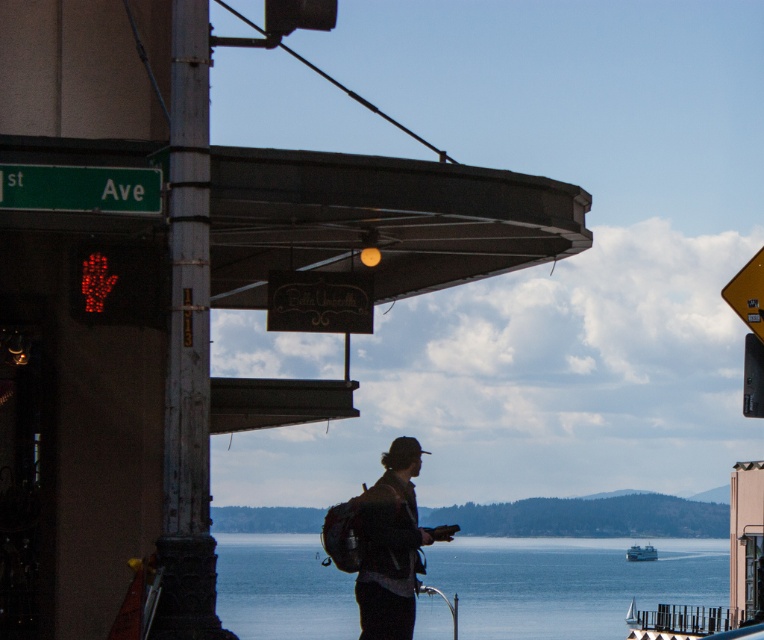
Between point (295, 262) and point (403, 593), which one is positioned behind?

The point (295, 262) is behind.

At what (x,y) coordinates should I click in order to perform the action: click on black matte awning at upper center. Please return your answer as a coordinate pair (x, y). This screenshot has width=764, height=640. Looking at the image, I should click on (379, 220).

Measure the distance between point (332, 570) and camera.

616.80 feet

Who is positioned more to the left, blue water at center or dark gray backpack at center?

From the viewer's perspective, blue water at center appears more on the left side.

Image resolution: width=764 pixels, height=640 pixels. Identify the location of blue water at center. (568, 582).

Which is in front, point (410, 522) or point (740, 280)?

Point (740, 280) is more forward.

What do you see at coordinates (389, 545) in the screenshot? This screenshot has width=764, height=640. I see `dark gray backpack at center` at bounding box center [389, 545].

Where is `dark gray backpack at center`? This screenshot has height=640, width=764. dark gray backpack at center is located at coordinates (389, 545).